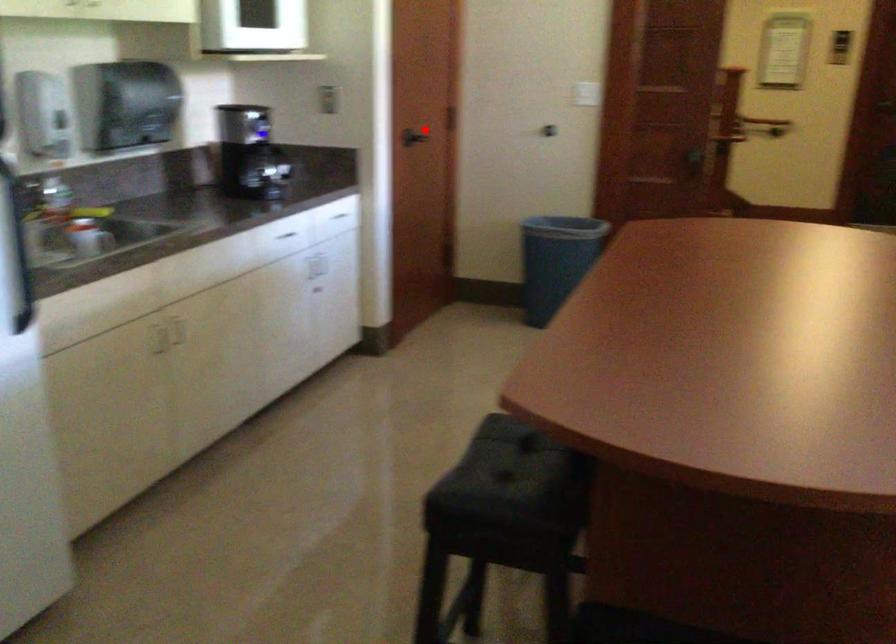
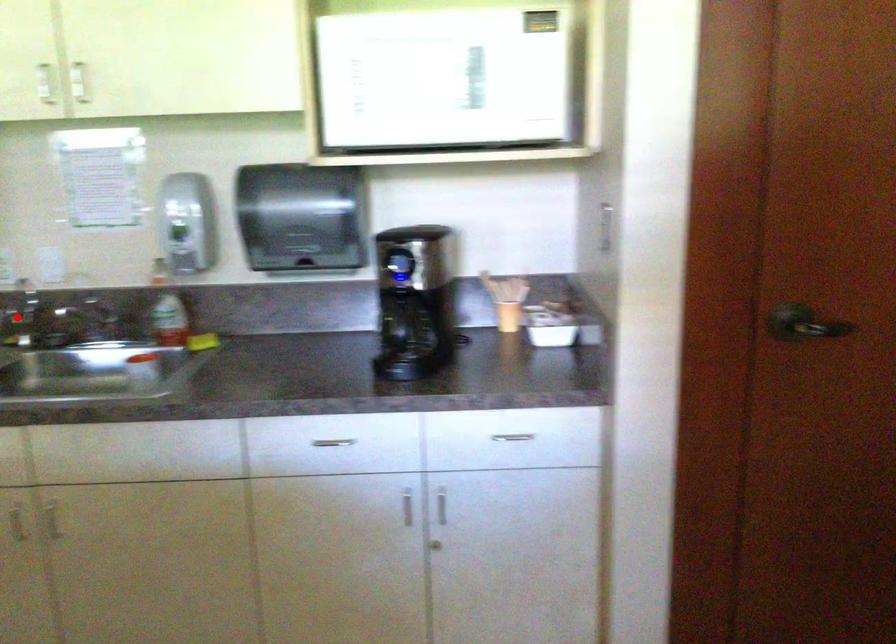
I am providing you with two images of the same scene from different viewpoints. A red point is marked on the first image and another point is marked on the second image. Is the marked point in image1 the same physical position as the marked point in image2?

No